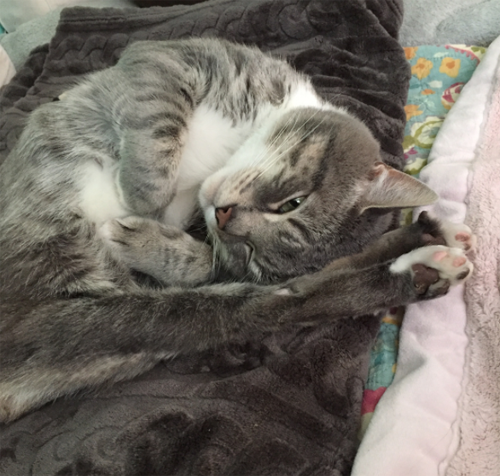
The width and height of the screenshot is (500, 476). I want to click on top left edge of black blanket, so click(x=66, y=7).